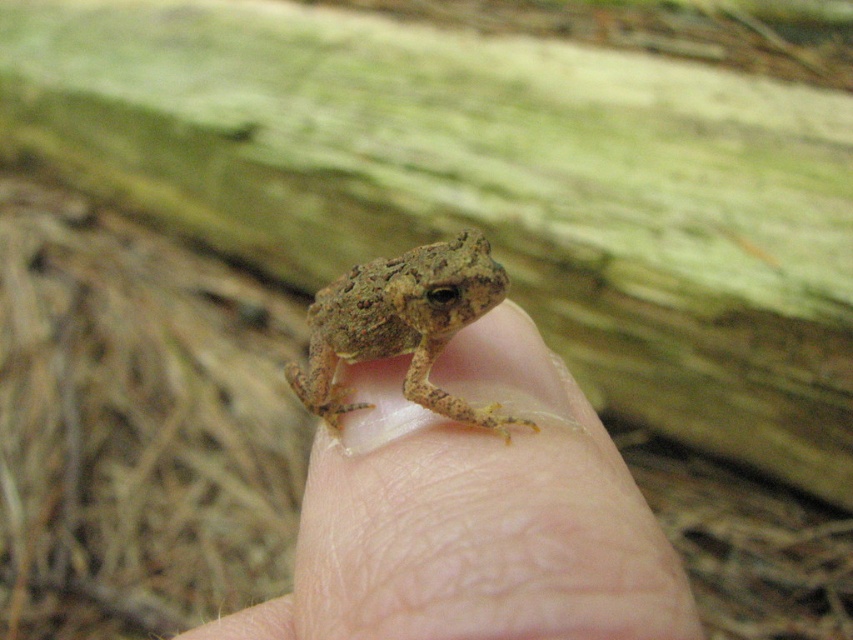
Can you confirm if brown rough skin at center is bigger than camouflage skin frog at center?

Indeed, brown rough skin at center has a larger size compared to camouflage skin frog at center.

Is brown rough skin at center thinner than camouflage skin frog at center?

Incorrect, brown rough skin at center's width is not less than camouflage skin frog at center's.

Is point (517, 586) behind point (306, 369)?

No, (517, 586) is closer to viewer.

Identify the location of brown rough skin at center. (473, 515).